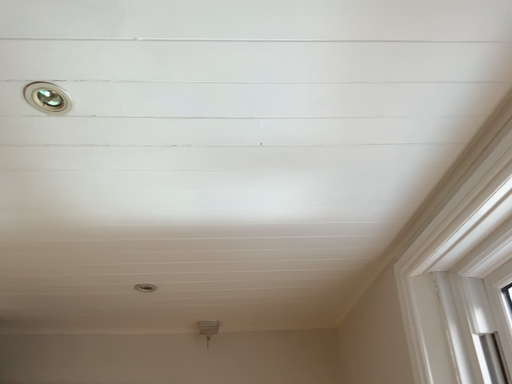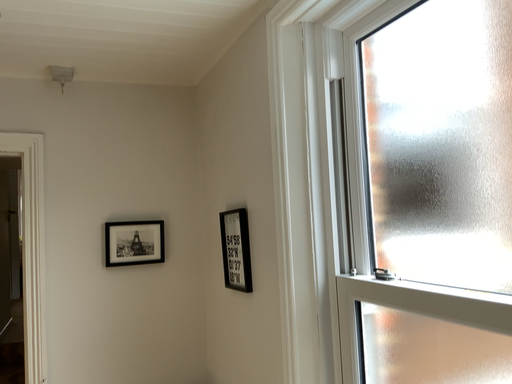
Question: Which way did the camera rotate in the video?

Choices:
 (A) rotated right
 (B) rotated left

Answer: (A)